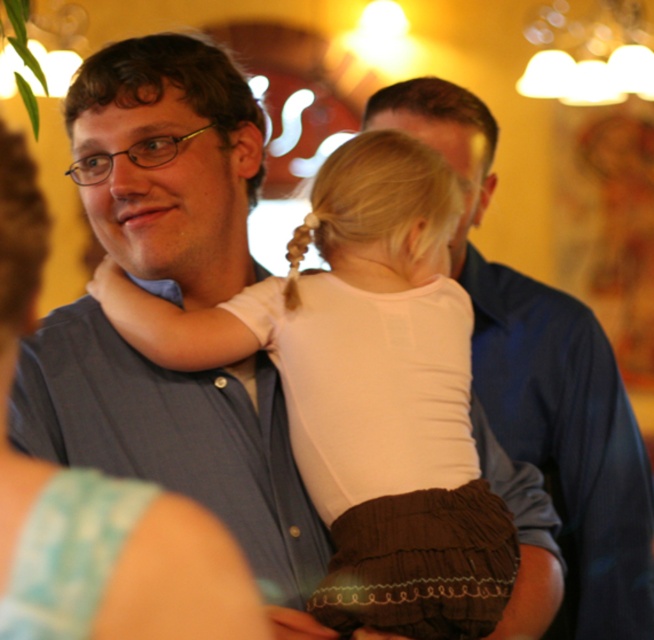
You are at a social gathering and want to take a photo of the two points marked in the image. Which point, point (x=387, y=282) or point (x=250, y=362), is closer to you?

Point (x=387, y=282) is closer to the viewer than point (x=250, y=362).

Based on the scene description, which object is taller between the white cotton shirt at center and the white fabric at left?

The white cotton shirt at center is much taller than the white fabric at left according to the description.